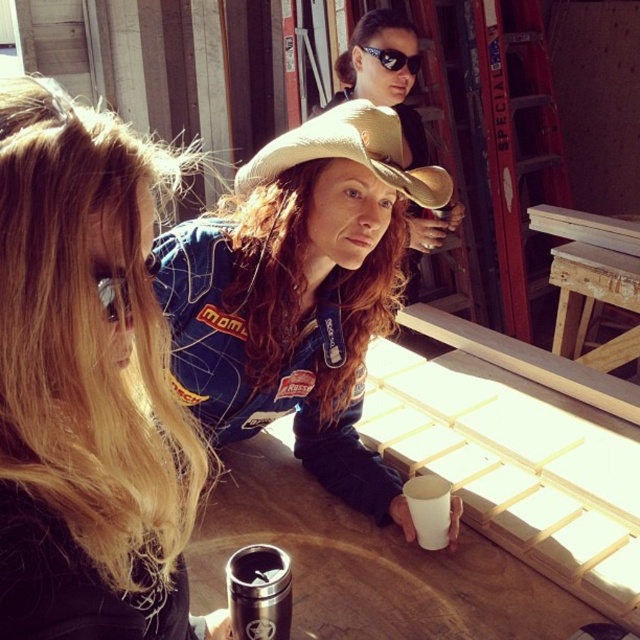
What are the coordinates of the tan fabric cowboy hat at center?

The tan fabric cowboy hat at center is located at coordinates point (349, 152).

You are designing a head accessory arrangement for a photography shoot. You have a brown suede cowboy hat at upper center and matte black goggles at upper center. Can both items fit on a person without overlapping if the minimum required space between them is 6.5 inches?

The brown suede cowboy hat at upper center and matte black goggles at upper center are 7.01 inches apart, which exceeds the minimum required space of 6.5 inches. Therefore, both items can fit on the person without overlapping.

You are a photographer trying to capture the brown suede cowboy hat at upper center and the matte black goggles at upper center in a single shot. Based on their arrangement, which object is closer to the camera?

The brown suede cowboy hat at upper center is positioned under the matte black goggles at upper center, so the goggles are closer to the camera since they are above the hat.